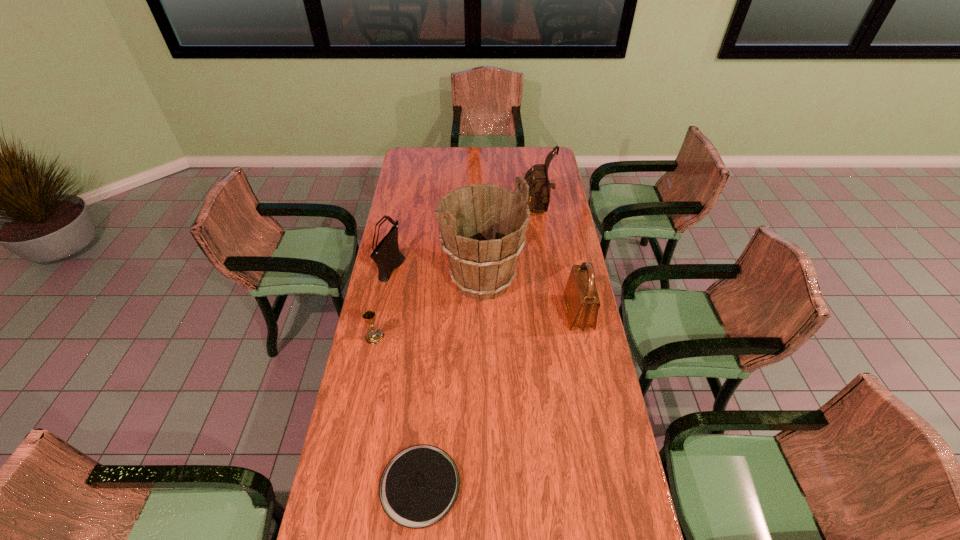
Where is `object that is the fourth closest to the shortest object`? This screenshot has width=960, height=540. object that is the fourth closest to the shortest object is located at coordinates (387, 256).

Locate which object is the second closest to the bucket. Please provide its 2D coordinates. Your answer should be formatted as a tuple, i.e. [(x, y)], where the tuple contains the x and y coordinates of a point satisfying the conditions above.

[(537, 178)]

Where is `shoulder bag that is the second nearest to the second shortest object`? The image size is (960, 540). shoulder bag that is the second nearest to the second shortest object is located at coordinates (581, 298).

The height and width of the screenshot is (540, 960). I want to click on shoulder bag that is the closest one to the chalice, so click(x=387, y=256).

Where is `vacant area that satisfies the following two spatial constraints: 1. on the back side of the pancake; 2. on the left side of the tallest object`? This screenshot has width=960, height=540. vacant area that satisfies the following two spatial constraints: 1. on the back side of the pancake; 2. on the left side of the tallest object is located at coordinates (439, 280).

You are a GUI agent. You are given a task and a screenshot of the screen. Output one action in this format:
    pyautogui.click(x=<x>, y=<y>)
    Task: Click on the free point that satisfies the following two spatial constraints: 1. on the front side of the shortest object; 2. on the right side of the second farthest shoulder bag
    
    Given the screenshot: What is the action you would take?
    pyautogui.click(x=348, y=485)

Locate an element on the screen. free point that satisfies the following two spatial constraints: 1. on the back side of the chalice; 2. on the left side of the tallest object is located at coordinates click(386, 280).